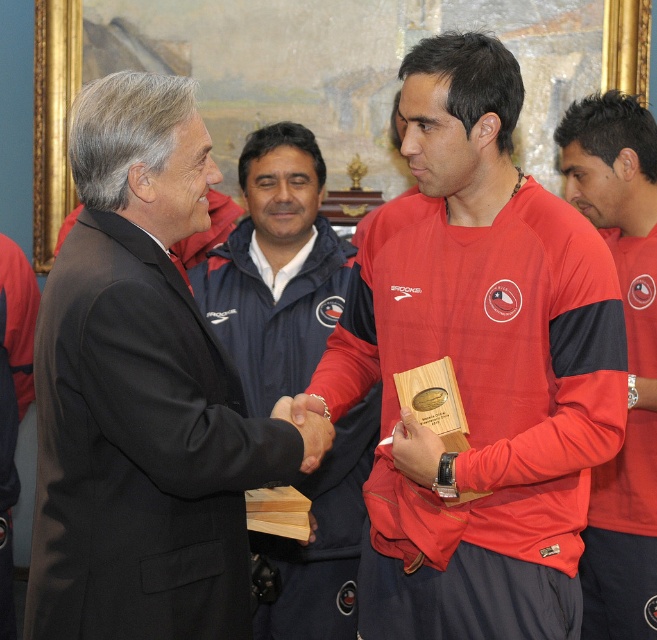
Question: Estimate the real-world distances between objects in this image. Which object is closer to the red matte jersey at center?

Choices:
 (A) red matte jacket at center
 (B) black suit at center
 (C) matte red jersey at center

Answer: (C)

Question: Which point is closer to the camera?

Choices:
 (A) (654, 392)
 (B) (215, 310)
 (C) (99, 252)

Answer: (C)

Question: Which point is farther to the camera?

Choices:
 (A) matte red jersey at center
 (B) black suit at center
 (C) red matte jersey at center
 (D) red matte jacket at center

Answer: (D)

Question: Observing the image, what is the correct spatial positioning of matte red jersey at center in reference to red matte jacket at center?

Choices:
 (A) right
 (B) left

Answer: (A)

Question: Considering the relative positions of red matte jacket at center and red matte jersey at center in the image provided, where is red matte jacket at center located with respect to red matte jersey at center?

Choices:
 (A) right
 (B) left

Answer: (B)

Question: Is matte red jersey at center wider than black suit at center?

Choices:
 (A) no
 (B) yes

Answer: (B)